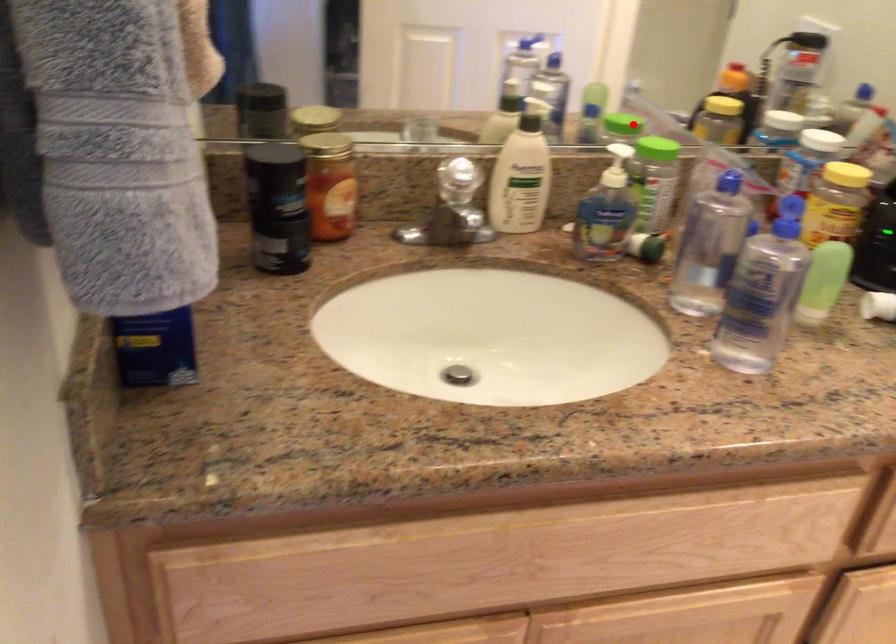
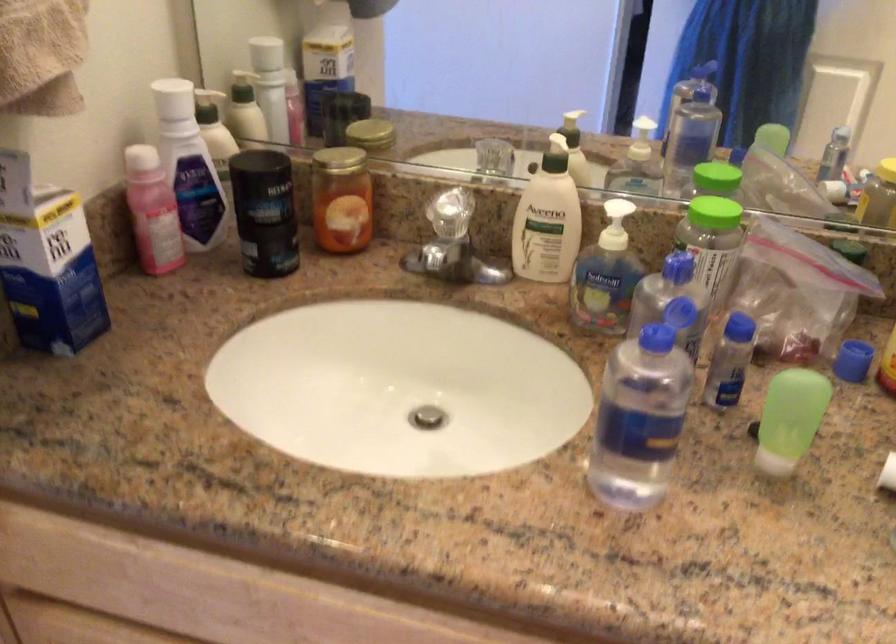
Question: I am providing you with two images of the same scene from different viewpoints. Image1 has a red point marked. In image2, the corresponding 3D location appears at what relative position? Reply with the corresponding letter.

Choices:
 (A) Closer
 (B) Farther

Answer: (A)